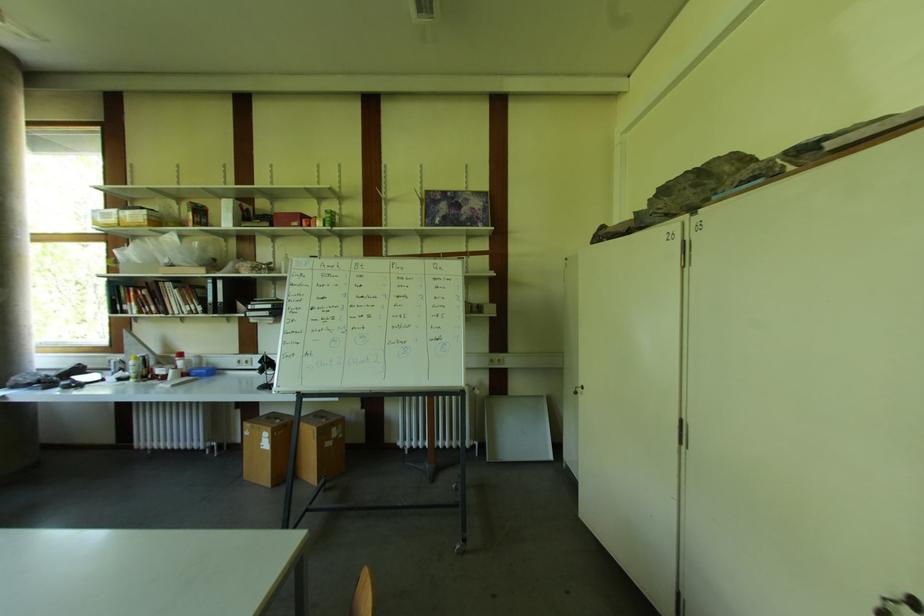
Locate an element on the screen. This screenshot has width=924, height=616. cabinet handle is located at coordinates (577, 389).